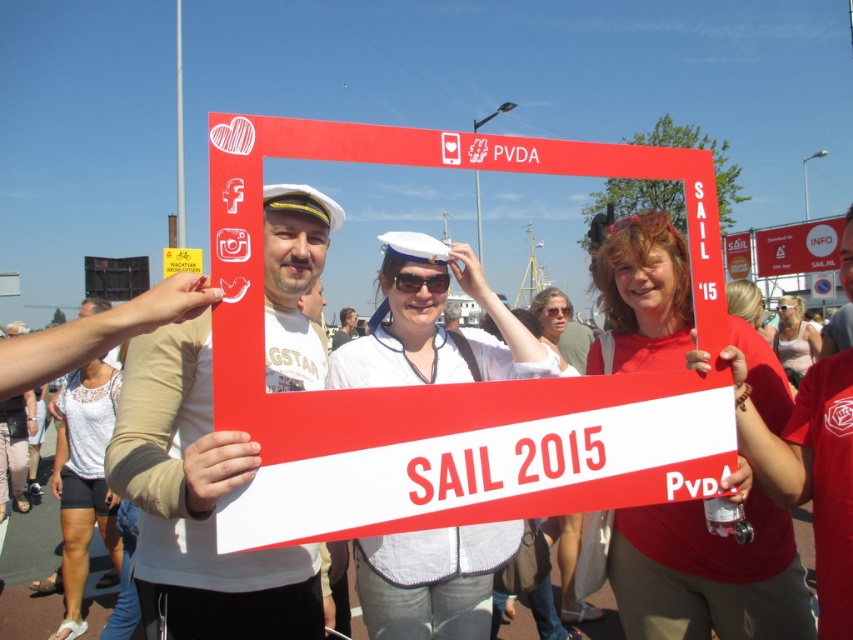
Which of these two, matte white sailor hat at left or red plastic sign at upper right, stands taller?

With more height is red plastic sign at upper right.

Can you confirm if matte white sailor hat at left is thinner than red plastic sign at upper right?

Correct, matte white sailor hat at left's width is less than red plastic sign at upper right's.

Is point (256, 616) closer to camera compared to point (833, 243)?

Yes, it is.

This screenshot has width=853, height=640. Find the location of `matte white sailor hat at left`. matte white sailor hat at left is located at coordinates (198, 500).

Is matte white sailor hat at left to the right of matte white blouse at center from the viewer's perspective?

No, matte white sailor hat at left is not to the right of matte white blouse at center.

Does matte white sailor hat at left have a greater height compared to matte white blouse at center?

Yes.

Does point (184, 481) lie behind point (776, 330)?

No, it is not.

The image size is (853, 640). In order to click on matte white sailor hat at left in this screenshot , I will do `click(198, 500)`.

Is point (469, 451) positioned before point (756, 260)?

Yes, point (469, 451) is in front of point (756, 260).

Is red plastic frame at center below red plastic sign at upper right?

Correct, red plastic frame at center is located below red plastic sign at upper right.

The image size is (853, 640). What do you see at coordinates (451, 388) in the screenshot? I see `red plastic frame at center` at bounding box center [451, 388].

The width and height of the screenshot is (853, 640). What are the coordinates of `red plastic frame at center` in the screenshot? It's located at (451, 388).